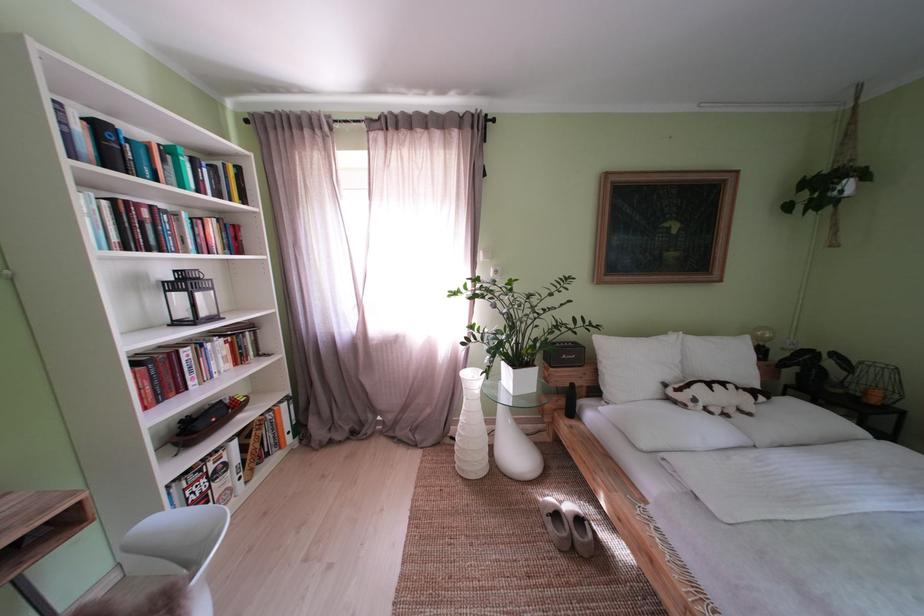
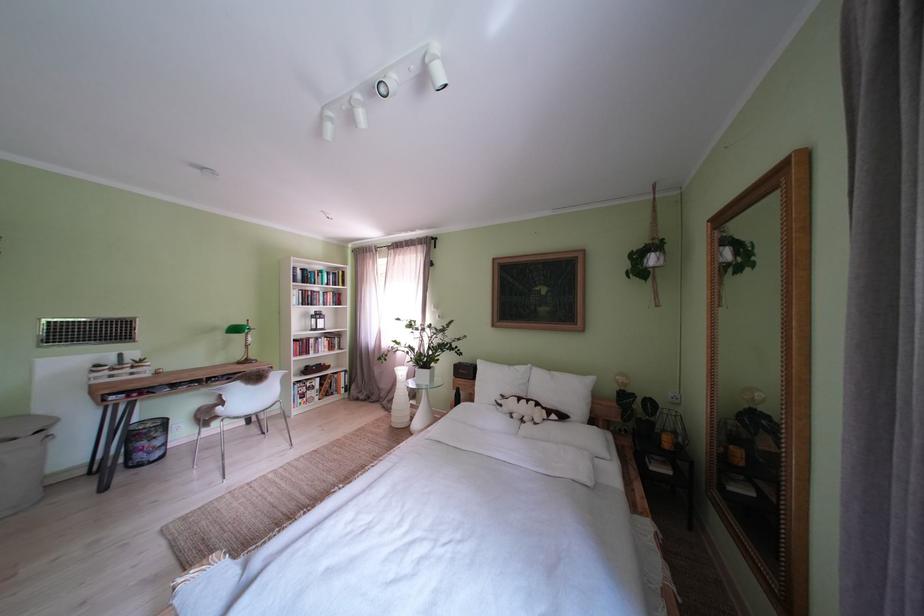
Find the pixel in the second image that matches (x=639, y=369) in the first image.

(500, 386)